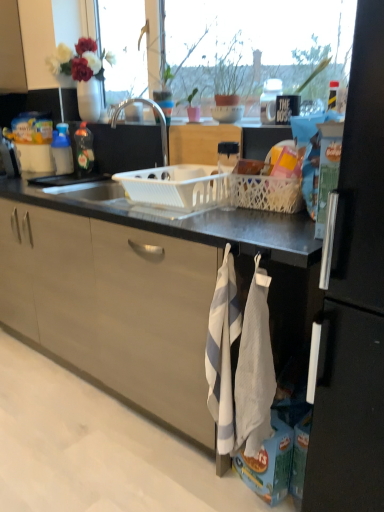
What do you see at coordinates (266, 193) in the screenshot?
I see `white mesh basket at right, positioned as the 1th basket in right-to-left order` at bounding box center [266, 193].

Find the location of a particular element. The width and height of the screenshot is (384, 512). matte silver faucet at center is located at coordinates (158, 118).

What do you see at coordinates (254, 369) in the screenshot? The image size is (384, 512). I see `white textured hand towel at lower right, the 2th hand towel when ordered from left to right` at bounding box center [254, 369].

Locate an element on the screen. This screenshot has width=384, height=512. white textured hand towel at lower right, which ranks as the 1th hand towel in right-to-left order is located at coordinates (254, 369).

Describe the element at coordinates (354, 300) in the screenshot. I see `black matte refrigerator at right` at that location.

The image size is (384, 512). I want to click on matte black mug at upper center, so click(269, 100).

Image resolution: width=384 pixels, height=512 pixels. In order to click on white mesh basket at right, positioned as the 1th basket in right-to-left order in this screenshot , I will do `click(266, 193)`.

How many degrees apart are the facing directions of translucent plastic bottle at left, which appears as the 2th kitchen appliance when viewed from the left, and blue plastic bottle at left, the 2th kitchen appliance in the right-to-left sequence?

The angle between the facing direction of translucent plastic bottle at left, which appears as the 2th kitchen appliance when viewed from the left, and the facing direction of blue plastic bottle at left, the 2th kitchen appliance in the right-to-left sequence, is 0.00872 degrees.

I want to click on kitchen appliance that appears below the translucent plastic bottle at left, acting as the first kitchen appliance starting from the right (from a real-world perspective), so pos(62,150).

Is translucent plastic bottle at left, which appears as the 2th kitchen appliance when viewed from the left, inside or outside of blue plastic bottle at left, placed as the 1th kitchen appliance when sorted from left to right?

translucent plastic bottle at left, which appears as the 2th kitchen appliance when viewed from the left, is not enclosed by blue plastic bottle at left, placed as the 1th kitchen appliance when sorted from left to right.

Is translucent plastic bottle at left, acting as the first kitchen appliance starting from the right, shorter than blue plastic bottle at left, the 2th kitchen appliance in the right-to-left sequence?

No.

Can you tell me how much white mesh basket at right, the second basket positioned from the left, and matte silver faucet at center differ in facing direction?

The angular difference between white mesh basket at right, the second basket positioned from the left, and matte silver faucet at center is 5.61 degrees.

From a real-world perspective, is white mesh basket at right, the second basket positioned from the left, located higher than matte silver faucet at center?

No, from a real-world perspective, white mesh basket at right, the second basket positioned from the left, is not on top of matte silver faucet at center.

Who is shorter, white mesh basket at right, the second basket positioned from the left, or matte silver faucet at center?

white mesh basket at right, the second basket positioned from the left, is shorter.

Does white mesh basket at right, the second basket positioned from the left, have a smaller size compared to matte silver faucet at center?

Correct, white mesh basket at right, the second basket positioned from the left, occupies less space than matte silver faucet at center.

Based on the photo, from the image's perspective, is white textured hand towel at lower center, which is the first hand towel from left to right, beneath green matte plant at upper center?

Indeed, from the image's perspective, white textured hand towel at lower center, which is the first hand towel from left to right, is shown beneath green matte plant at upper center.

Is white textured hand towel at lower center, which is the first hand towel from left to right, placed right next to green matte plant at upper center?

They are not placed beside each other.

Considering their positions, is white textured hand towel at lower center, acting as the second hand towel starting from the right, located in front of or behind green matte plant at upper center?

Clearly, white textured hand towel at lower center, acting as the second hand towel starting from the right, is in front of green matte plant at upper center.

Considering the points (209, 332) and (235, 81), which point is behind, point (209, 332) or point (235, 81)?

The point (235, 81) is behind.

You are a GUI agent. You are given a task and a screenshot of the screen. Output one action in this format:
    pyautogui.click(x=<x>, y=<y>)
    Task: Click on the 2nd hand towel below the green matte plant at upper center (from the image's perspective)
    This screenshot has height=512, width=384.
    Given the screenshot: What is the action you would take?
    pyautogui.click(x=254, y=369)

Is green matte plant at upper center not near white textured hand towel at lower right, which ranks as the 1th hand towel in right-to-left order?

Indeed, green matte plant at upper center is not near white textured hand towel at lower right, which ranks as the 1th hand towel in right-to-left order.

Could you tell me if green matte plant at upper center is turned towards white textured hand towel at lower right, the 2th hand towel when ordered from left to right?

No, green matte plant at upper center is not oriented towards white textured hand towel at lower right, the 2th hand towel when ordered from left to right.

From the image's perspective, does green matte plant at upper center appear higher than white textured hand towel at lower right, the 2th hand towel when ordered from left to right?

Yes.

From the image's perspective, which one is positioned higher, white textured hand towel at lower right, the 2th hand towel when ordered from left to right, or white mesh basket at right, positioned as the 1th basket in right-to-left order?

white mesh basket at right, positioned as the 1th basket in right-to-left order, appears higher in the image.

Is point (269, 400) more distant than point (246, 191)?

No, (269, 400) is closer to viewer.

Which object is further away from the camera taking this photo, white textured hand towel at lower right, the 2th hand towel when ordered from left to right, or white mesh basket at right, the second basket positioned from the left?

white mesh basket at right, the second basket positioned from the left, is further from the camera.

From a real-world perspective, relative to white mesh basket at right, positioned as the 1th basket in right-to-left order, is white textured hand towel at lower right, which ranks as the 1th hand towel in right-to-left order, vertically above or below?

In terms of real-world spatial position, white textured hand towel at lower right, which ranks as the 1th hand towel in right-to-left order, is below white mesh basket at right, positioned as the 1th basket in right-to-left order.

Considering the relative positions of translucent plastic bottle at left, acting as the first kitchen appliance starting from the right, and green matte plant at upper center in the image provided, is translucent plastic bottle at left, acting as the first kitchen appliance starting from the right, to the right of green matte plant at upper center from the viewer's perspective?

No, translucent plastic bottle at left, acting as the first kitchen appliance starting from the right, is not to the right of green matte plant at upper center.

Does translucent plastic bottle at left, acting as the first kitchen appliance starting from the right, have a lesser width compared to green matte plant at upper center?

Yes.

Is translucent plastic bottle at left, which appears as the 2th kitchen appliance when viewed from the left, not close to green matte plant at upper center?

translucent plastic bottle at left, which appears as the 2th kitchen appliance when viewed from the left, is near green matte plant at upper center, not far away.

Is matte black mug at upper center facing towards green matte plant at upper center?

No, matte black mug at upper center does not turn towards green matte plant at upper center.

From the image's perspective, between matte black mug at upper center and green matte plant at upper center, which one is located above?

green matte plant at upper center is shown above in the image.

Is matte black mug at upper center in front of or behind green matte plant at upper center in the image?

Visually, matte black mug at upper center is located behind green matte plant at upper center.

Considering the positions of objects matte black mug at upper center and green matte plant at upper center in the image provided, who is more to the left, matte black mug at upper center or green matte plant at upper center?

green matte plant at upper center.

The width and height of the screenshot is (384, 512). I want to click on kitchen appliance on the left of the translucent plastic bottle at left, acting as the first kitchen appliance starting from the right, so click(x=62, y=150).

Image resolution: width=384 pixels, height=512 pixels. I want to click on tap behind the white mesh basket at right, the second basket positioned from the left, so click(x=158, y=118).

From the image, which object appears to be farther from translucent plastic bottle at left, which appears as the 2th kitchen appliance when viewed from the left, blue plastic bottle at left, the 2th kitchen appliance in the right-to-left sequence, or black matte refrigerator at right?

black matte refrigerator at right lies further to translucent plastic bottle at left, which appears as the 2th kitchen appliance when viewed from the left, than the other object.

Based on their spatial positions, is green matte plant at upper center or white plastic basket at center closer to white textured hand towel at lower right, the 2th hand towel when ordered from left to right?

Among the two, white plastic basket at center is located nearer to white textured hand towel at lower right, the 2th hand towel when ordered from left to right.

Which object lies further to the anchor point matte silver faucet at center, white plastic basket at center, arranged as the first basket when viewed from the left, or blue plastic bottle at left, the 2th kitchen appliance in the right-to-left sequence?

blue plastic bottle at left, the 2th kitchen appliance in the right-to-left sequence, lies further to matte silver faucet at center than the other object.

From the image, which object appears to be farther from white plastic basket at center, green matte plant at upper center or matte silver faucet at center?

matte silver faucet at center lies further to white plastic basket at center than the other object.

Considering their positions, is white textured hand towel at lower right, which ranks as the 1th hand towel in right-to-left order, positioned closer to translucent plastic bottle at left, which appears as the 2th kitchen appliance when viewed from the left, than white textured hand towel at lower center, acting as the second hand towel starting from the right?

white textured hand towel at lower center, acting as the second hand towel starting from the right, is positioned closer to the anchor translucent plastic bottle at left, which appears as the 2th kitchen appliance when viewed from the left.

Looking at the image, which one is located closer to matte black mug at upper center, white plastic basket at center or white textured hand towel at lower center, acting as the second hand towel starting from the right?

white plastic basket at center.

Which object lies further to the anchor point black matte refrigerator at right, matte silver faucet at center or translucent plastic bottle at left, which appears as the 2th kitchen appliance when viewed from the left?

Based on the image, translucent plastic bottle at left, which appears as the 2th kitchen appliance when viewed from the left, appears to be further to black matte refrigerator at right.

Which object lies further to the anchor point translucent plastic bottle at left, which appears as the 2th kitchen appliance when viewed from the left, white plastic basket at center or black matte refrigerator at right?

black matte refrigerator at right is positioned further to the anchor translucent plastic bottle at left, which appears as the 2th kitchen appliance when viewed from the left.

Identify the location of houseplant located between white textured hand towel at lower center, which is the first hand towel from left to right, and translucent plastic bottle at left, acting as the first kitchen appliance starting from the right, in the depth direction. (230, 72).

You are a GUI agent. You are given a task and a screenshot of the screen. Output one action in this format:
    pyautogui.click(x=<x>, y=<y>)
    Task: Click on the appliance between green matte plant at upper center and white textured hand towel at lower right, the 2th hand towel when ordered from left to right, in the vertical direction
    The width and height of the screenshot is (384, 512).
    Given the screenshot: What is the action you would take?
    pyautogui.click(x=269, y=100)

At what (x,y) coordinates should I click in order to perform the action: click on houseplant between white textured hand towel at lower right, the 2th hand towel when ordered from left to right, and blue plastic bottle at left, placed as the 1th kitchen appliance when sorted from left to right, in the front-back direction. Please return your answer as a coordinate pair (x, y). Looking at the image, I should click on (230, 72).

In order to click on refrigerator that lies between green matte plant at upper center and white textured hand towel at lower right, which ranks as the 1th hand towel in right-to-left order, from top to bottom in this screenshot , I will do `click(354, 300)`.